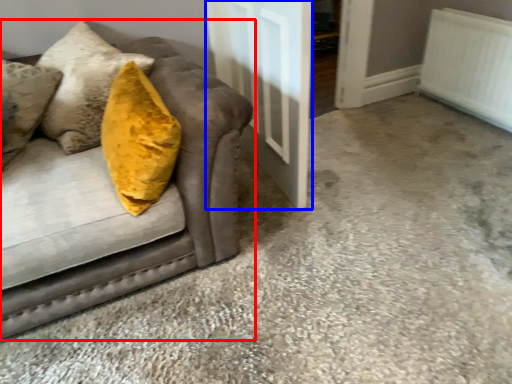
Question: Which object is further to the camera taking this photo, studio couch (highlighted by a red box) or door (highlighted by a blue box)?

Choices:
 (A) studio couch
 (B) door

Answer: (B)